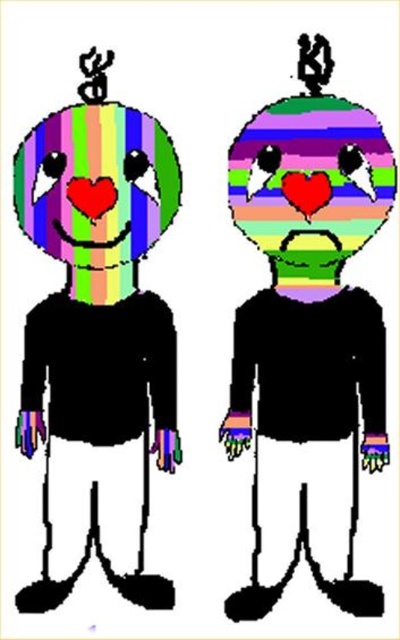
Is striped rubber heart at center thinner than rainbow striped face at center?

In fact, striped rubber heart at center might be wider than rainbow striped face at center.

Is point (234, 202) positioned behind point (122, 227)?

Yes, point (234, 202) is behind point (122, 227).

Between point (233, 209) and point (62, 214), which one is positioned behind?

The point (233, 209) is more distant.

Where is `striped rubber heart at center`? The image size is (400, 640). striped rubber heart at center is located at coordinates (310, 184).